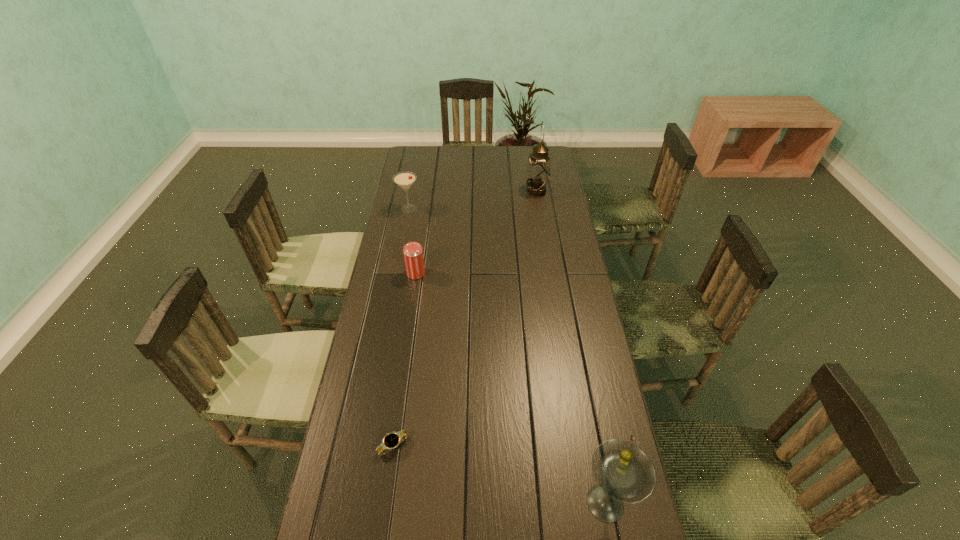
Where is `vacant position located on the front of the oil lamp`? vacant position located on the front of the oil lamp is located at coordinates (542, 224).

Locate an element on the screen. free space located 0.380m on the left of the nearer martini is located at coordinates (423, 503).

The height and width of the screenshot is (540, 960). In order to click on free space located on the front of the shorter martini in this screenshot , I will do `click(399, 260)`.

Locate an element on the screen. Image resolution: width=960 pixels, height=540 pixels. vacant area situated 0.170m on the back of the beer can is located at coordinates click(421, 238).

I want to click on vacant region located 0.270m on the back of the watch, so click(x=406, y=353).

Where is `martini located in the left edge section of the desktop`? The image size is (960, 540). martini located in the left edge section of the desktop is located at coordinates (405, 179).

This screenshot has height=540, width=960. In order to click on beer can present at the left edge in this screenshot , I will do `click(413, 252)`.

Where is `watch located at the left edge`? This screenshot has height=540, width=960. watch located at the left edge is located at coordinates coord(392,440).

In order to click on oil lamp that is positioned at the right edge in this screenshot , I will do [538, 169].

Where is `martini situated at the right edge`? martini situated at the right edge is located at coordinates (624, 473).